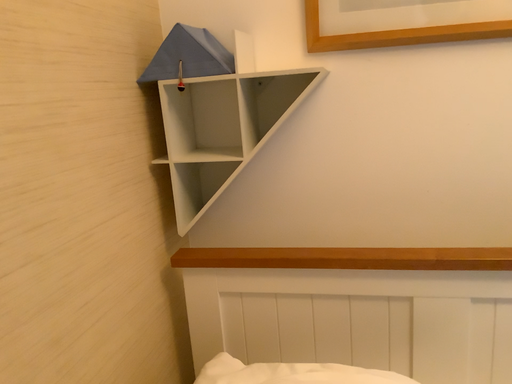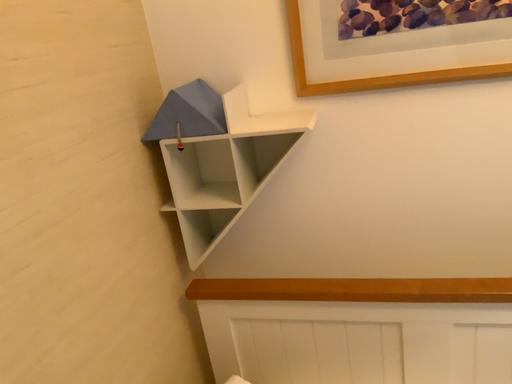
Question: How did the camera likely rotate when shooting the video?

Choices:
 (A) rotated downward
 (B) rotated upward

Answer: (A)